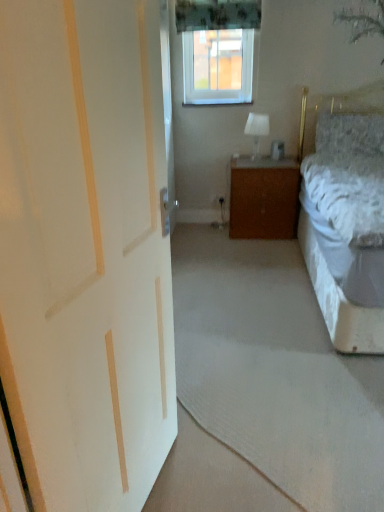
Locate an element on the screen. vacant area in front of wooden cabinet at center is located at coordinates (253, 245).